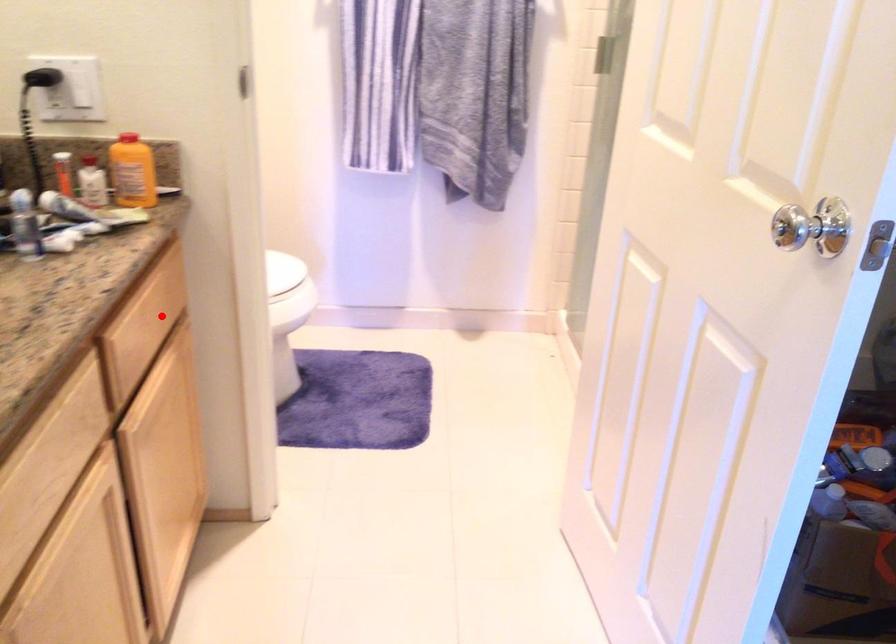
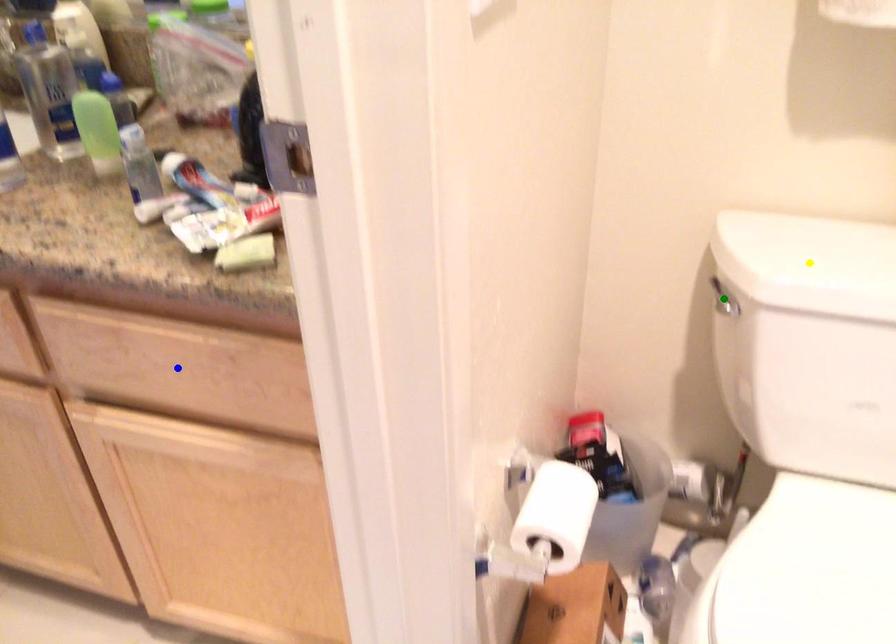
Question: I am providing you with two images of the same scene from different viewpoints. A red point is marked on the first image. You are given multiple points on the second image. Which spot in image 2 lines up with the point in image 1?

Choices:
 (A) green point
 (B) yellow point
 (C) blue point

Answer: (C)